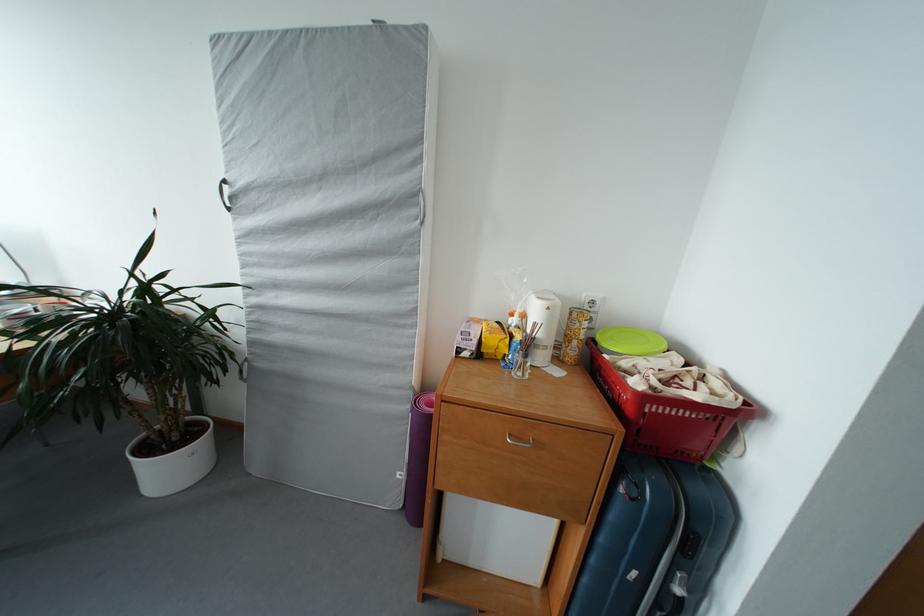
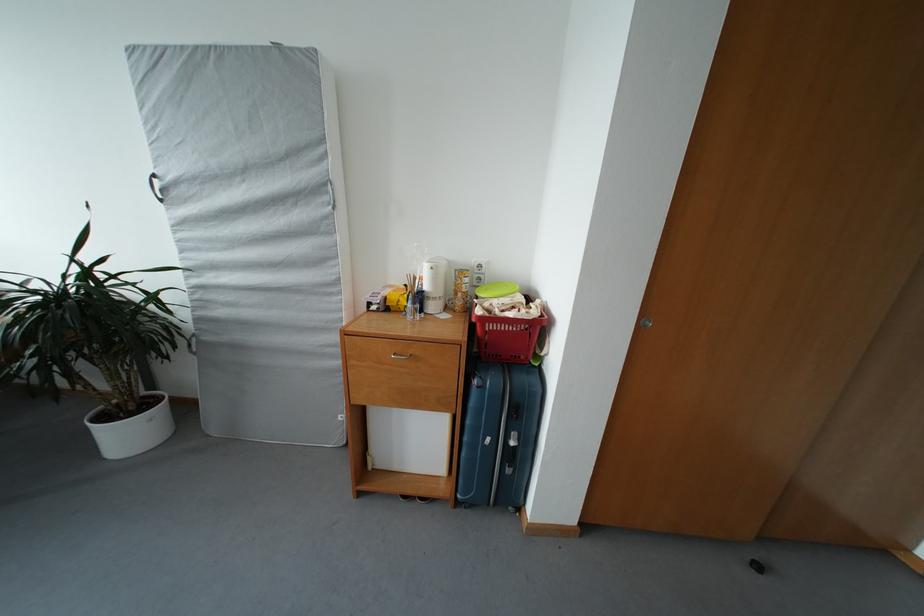
Find the pixel in the second image that matches the point at 576,346 in the first image.

(463, 300)